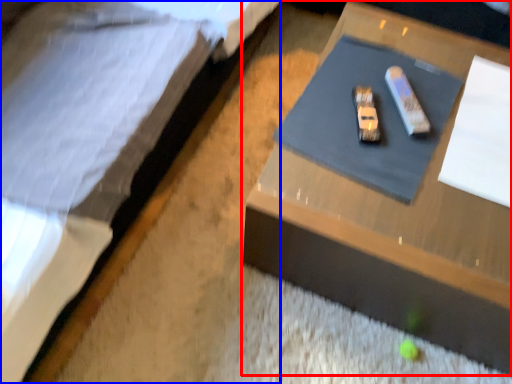
Question: Which object is further to the camera taking this photo, table (highlighted by a red box) or bed (highlighted by a blue box)?

Choices:
 (A) table
 (B) bed

Answer: (A)